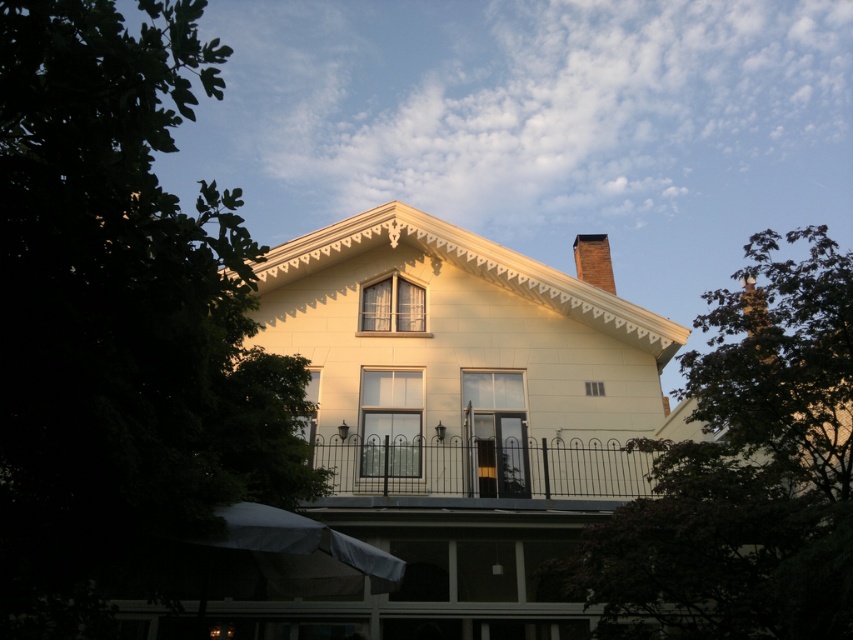
You are standing in the garden of the house and want to know which object is taller between the green leafy tree at upper right and the black metal fence at center. Can you determine which one is taller?

The green leafy tree at upper right is taller than the black metal fence at center according to the description.

You are standing in front of the house and notice a point marked at coordinates (119, 316). Based on the scene description, what object is located at that point?

The point at coordinates (119, 316) corresponds to the green leafy tree at left.

Based on the scene description, which tree, the green leafy tree at left or the green leafy tree at upper right, has a larger width?

The green leafy tree at left might be wider than the green leafy tree at upper right.